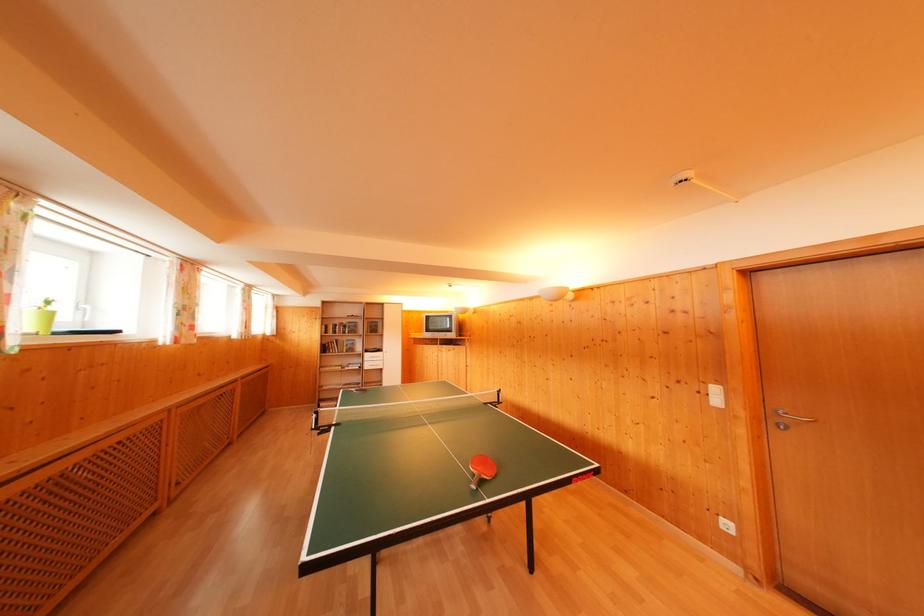
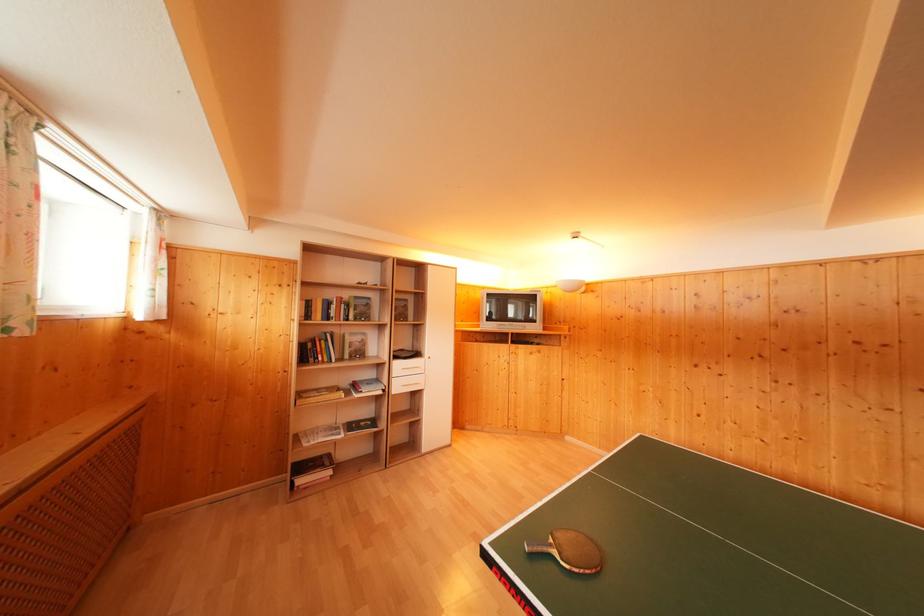
Find the pixel in the second image that matches (x=360, y=384) in the first image.

(371, 416)